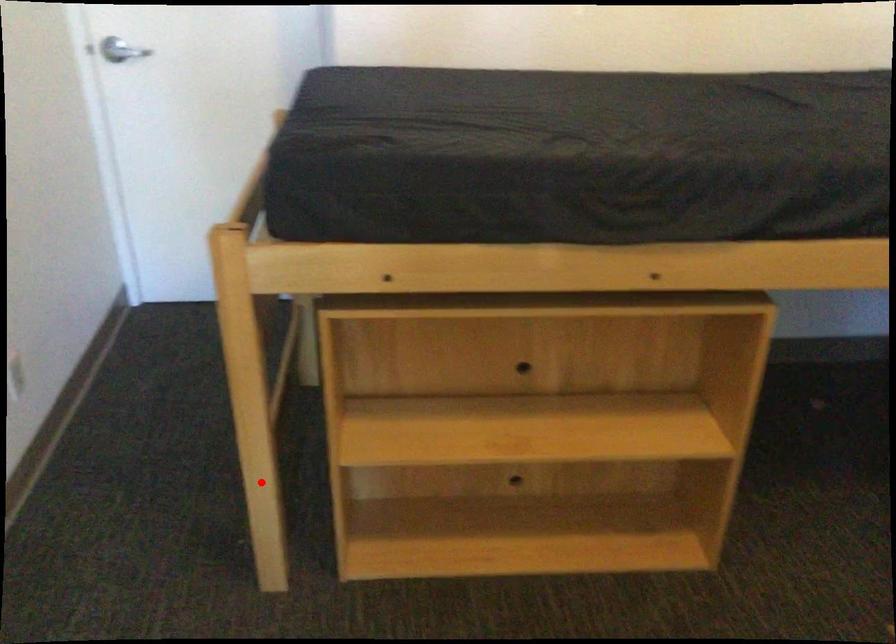
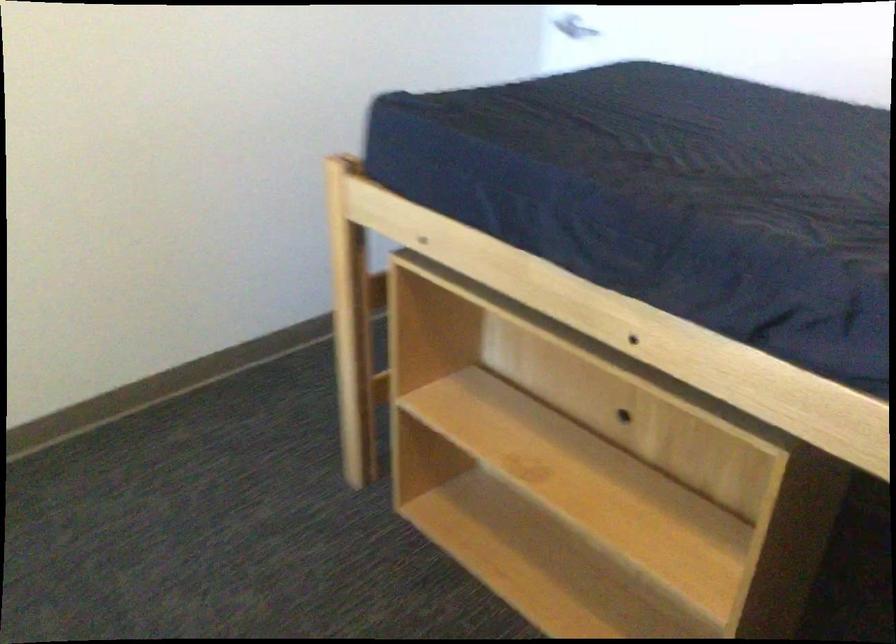
Question: I am providing you with two images of the same scene from different viewpoints. A red point is marked on the first image. Can you still see the location of the red point in image 2?

Choices:
 (A) Yes
 (B) No

Answer: (A)